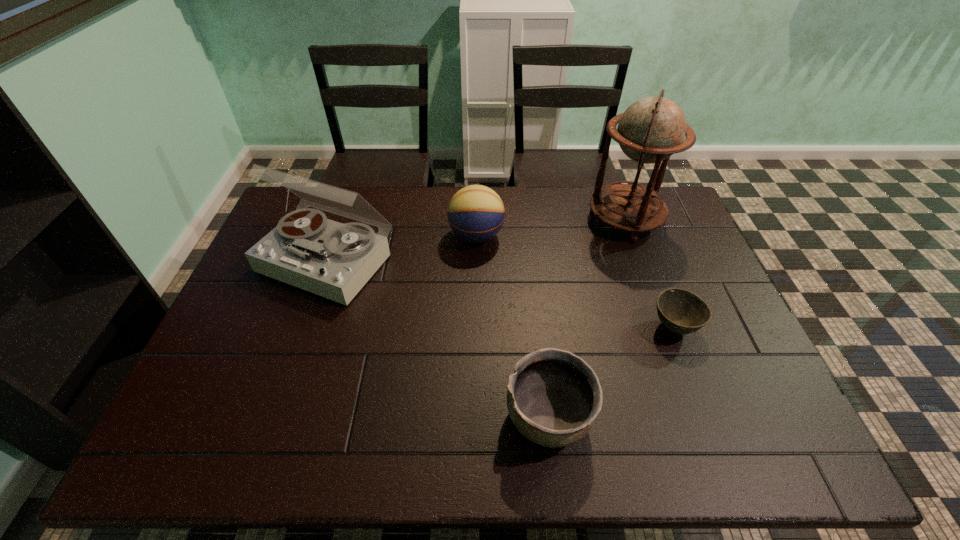
Where is `globe that is at the right edge`? The height and width of the screenshot is (540, 960). globe that is at the right edge is located at coordinates (653, 128).

The height and width of the screenshot is (540, 960). Identify the location of bowl located at the right edge. (680, 311).

Find the location of `object that is positioned at the far left corner`. object that is positioned at the far left corner is located at coordinates (334, 260).

In order to click on object located at the far right corner in this screenshot , I will do `click(653, 128)`.

Find the location of a particular element. This screenshot has height=540, width=960. vacant point at the far edge is located at coordinates (514, 220).

At what (x,y) coordinates should I click in order to perform the action: click on vacant region at the near edge. Please return your answer as a coordinate pair (x, y). Looking at the image, I should click on (676, 458).

In the image, there is a desktop. Where is `blank space at the left edge`? The width and height of the screenshot is (960, 540). blank space at the left edge is located at coordinates click(x=227, y=381).

Identify the location of vacant space at the right edge of the desktop. (700, 257).

Find the location of a particular element. vacant area that lies between the leftmost object and the fourth tallest object is located at coordinates (438, 339).

At what (x,y) coordinates should I click in order to perform the action: click on free spot between the tallest object and the nearest object. Please return your answer as a coordinate pair (x, y). Image resolution: width=960 pixels, height=540 pixels. Looking at the image, I should click on (587, 319).